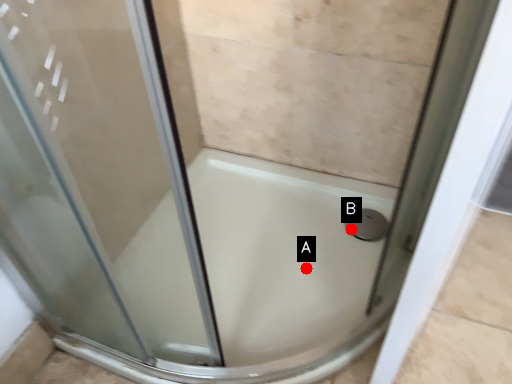
Question: Two points are circled on the image, labeled by A and B beside each circle. Which of the following is the closest to the observer?

Choices:
 (A) A is closer
 (B) B is closer

Answer: (A)